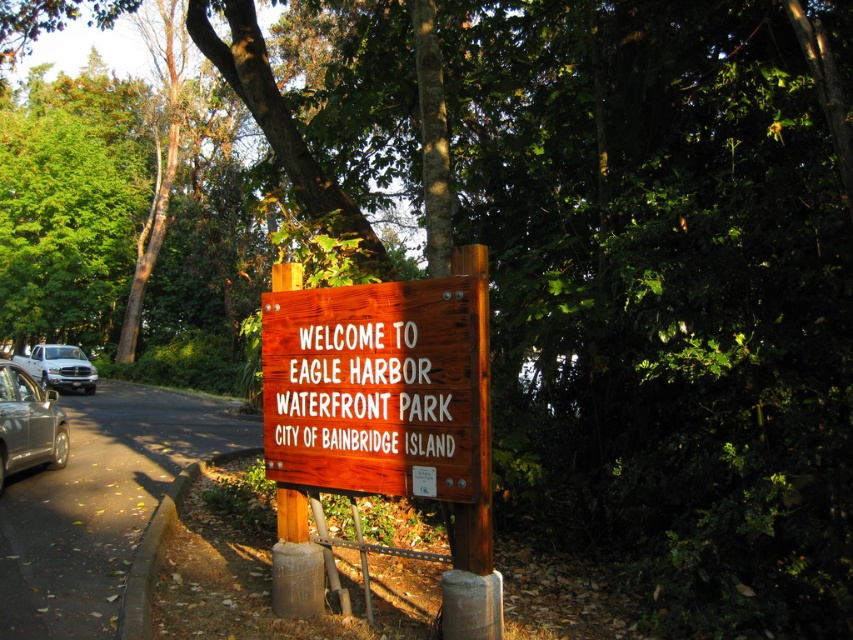
You are a visitor arriving at Eagle Harbor Waterfront Park and see the wooden sign at center and the silver metallic car at left. Which object is shorter in height?

The wooden sign at center is shorter in height than the silver metallic car at left because the wooden sign at center is not as tall as the silver metallic car at left.

You are a visitor arriving at Eagle Harbor Waterfront Park and see the silver metallic car at left and the white matte truck at left. Which vehicle is parked closer to the entrance of the park?

The silver metallic car at left is parked closer to the entrance of the park because it is positioned under the white matte truck at left, indicating it is in front.

You are a photographer planning to take a picture of the wooden sign at center and the white matte truck at left. Based on their sizes, which object should you focus on first to ensure both are in frame without moving the camera?

The wooden sign at center is smaller than the white matte truck at left, so you should focus on the white matte truck at left first to ensure both fit in the frame since it takes up more space.